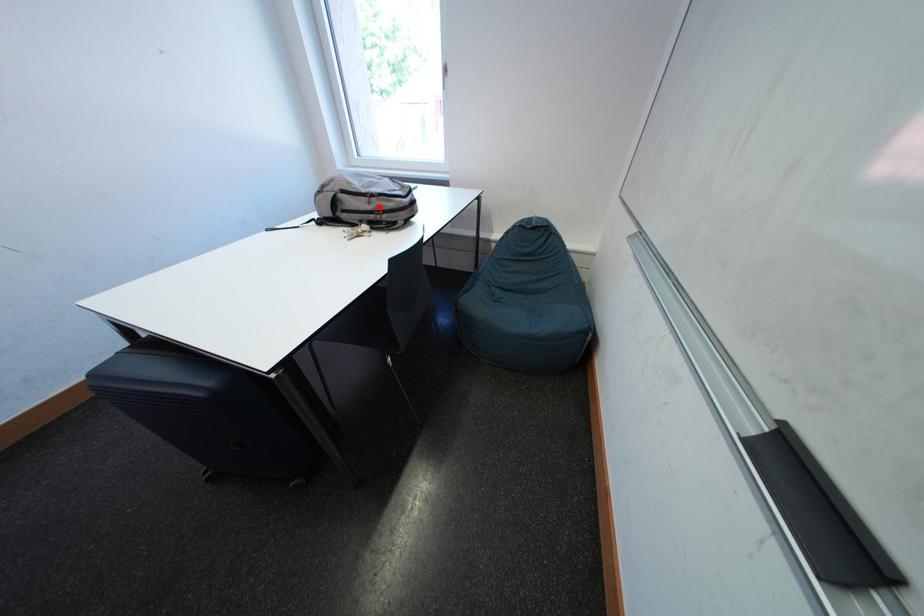
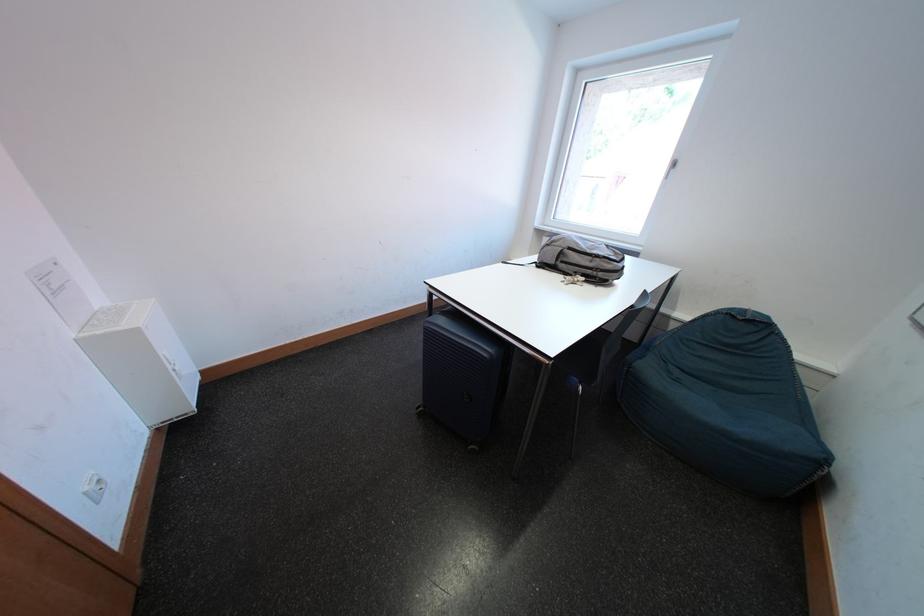
The point at the highlighted location is marked in the first image. Where is the corresponding point in the second image?

(601, 265)